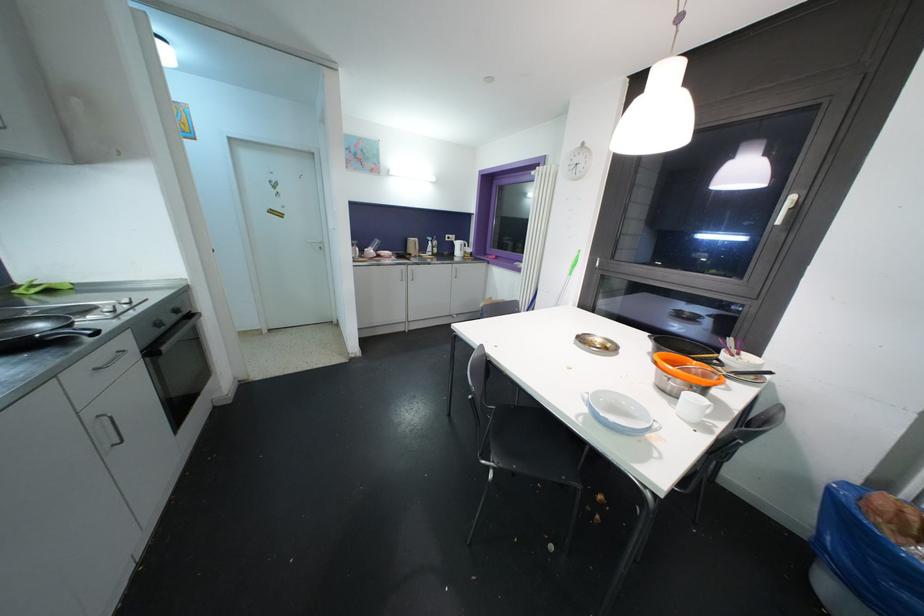
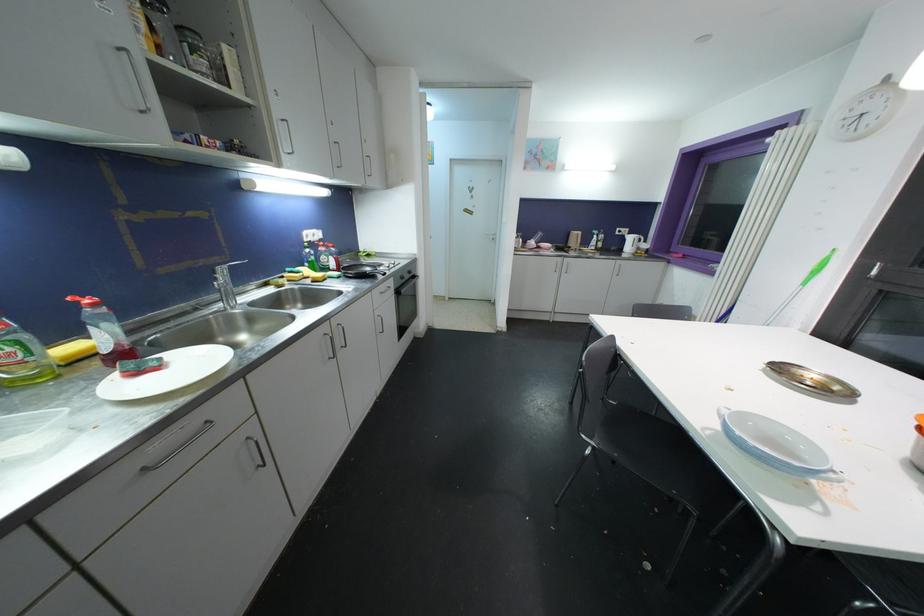
Locate, in the second image, the point that corresponds to pixel 586 342 in the first image.

(784, 371)